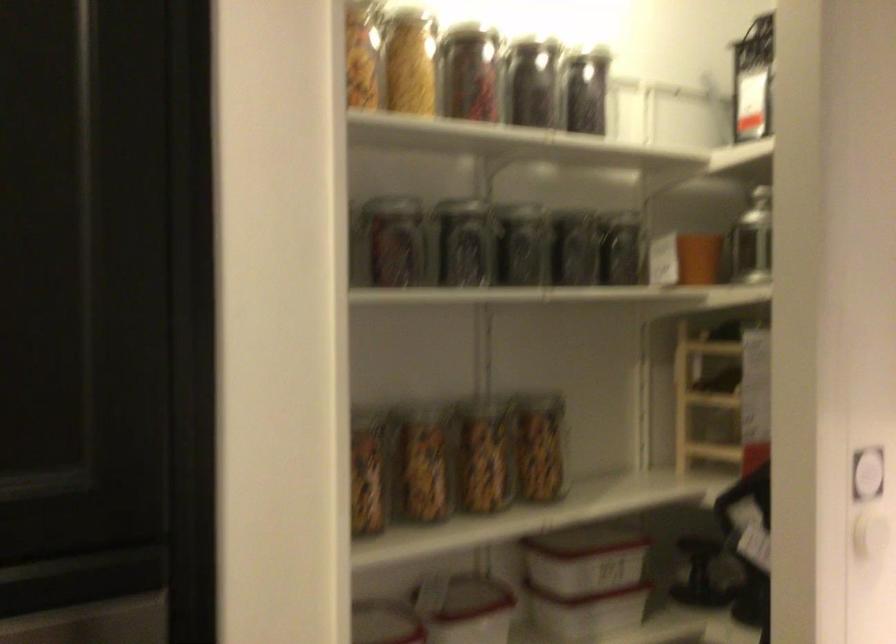
You are a GUI agent. You are given a task and a screenshot of the screen. Output one action in this format:
    pyautogui.click(x=<x>, y=<y>)
    Task: Click on the black lantern handle
    This screenshot has height=644, width=896.
    Given the screenshot: What is the action you would take?
    pyautogui.click(x=700, y=574)